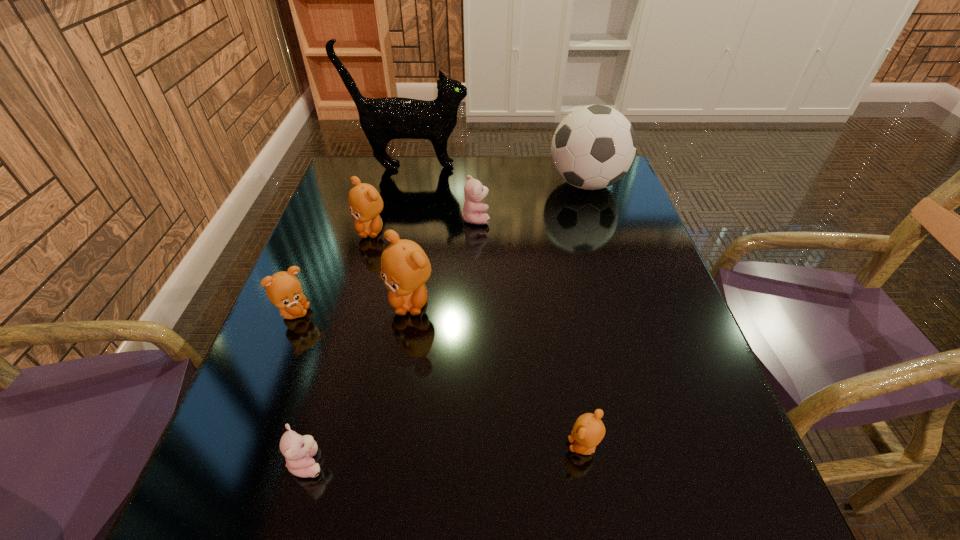
The width and height of the screenshot is (960, 540). In order to click on object located at the far left corner in this screenshot , I will do pyautogui.click(x=382, y=119).

Image resolution: width=960 pixels, height=540 pixels. Find the location of `object that is at the far right corner`. object that is at the far right corner is located at coordinates (593, 147).

Identify the location of free spot at the far edge of the desktop. The width and height of the screenshot is (960, 540). tap(460, 170).

I want to click on free space at the right edge, so click(627, 271).

At what (x,y) coordinates should I click in order to perform the action: click on free region at the far left corner of the desktop. Please return your answer as a coordinate pair (x, y). The image size is (960, 540). Looking at the image, I should click on (362, 159).

At what (x,y) coordinates should I click in order to perform the action: click on free space at the near left corner of the desktop. Please return your answer as a coordinate pair (x, y). Image resolution: width=960 pixels, height=540 pixels. Looking at the image, I should click on (214, 508).

Locate an element on the screen. Image resolution: width=960 pixels, height=540 pixels. vacant space at the far right corner of the desktop is located at coordinates (621, 184).

Find the location of a particular element. This screenshot has width=960, height=540. free space between the nearer pink teddy bear and the biggest brown teddy bear is located at coordinates (359, 382).

Find the location of a particular element. This screenshot has height=540, width=960. vacant area between the third tallest object and the third biggest brown teddy bear is located at coordinates click(x=352, y=307).

Identify the location of vacant area between the fourth teddy bear from left to right and the leftmost brown teddy bear. This screenshot has width=960, height=540. (352, 307).